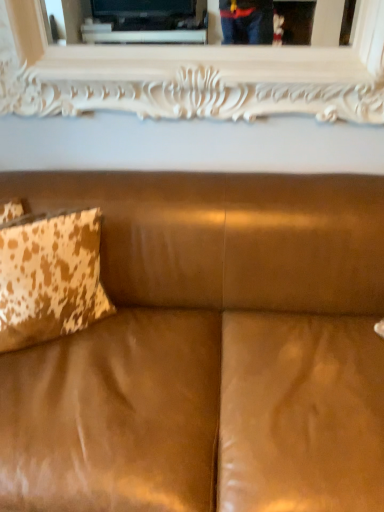
Question: Is white carved wood picture frame at upper center bigger or smaller than suede brown couch at center?

Choices:
 (A) big
 (B) small

Answer: (B)

Question: Relative to suede brown couch at center, is white carved wood picture frame at upper center in front or behind?

Choices:
 (A) front
 (B) behind

Answer: (B)

Question: Which of these objects is positioned closest to the cowhide-patterned pillow at left?

Choices:
 (A) suede brown couch at center
 (B) white carved wood picture frame at upper center

Answer: (A)

Question: Which object is positioned closest to the suede brown couch at center?

Choices:
 (A) white carved wood picture frame at upper center
 (B) cowhide-patterned pillow at left

Answer: (B)